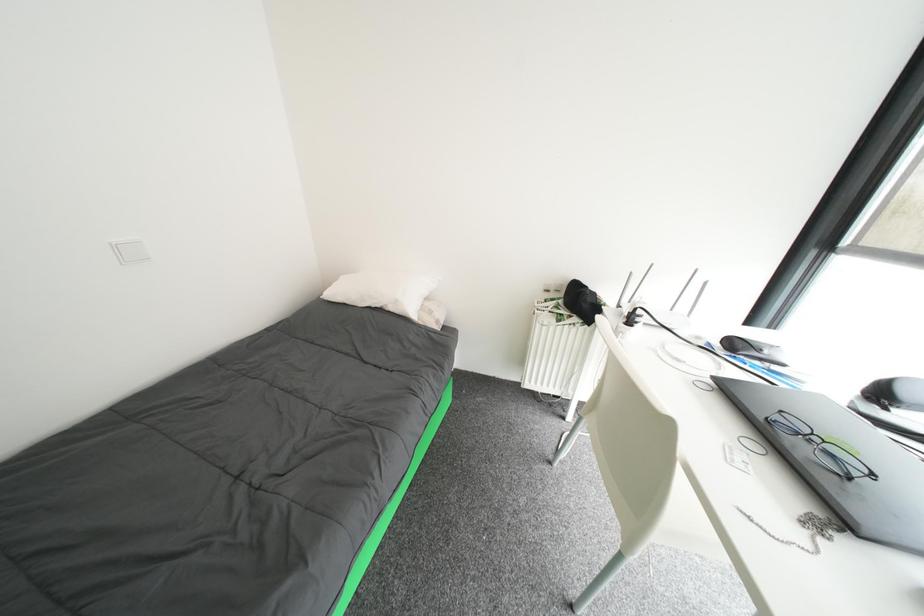
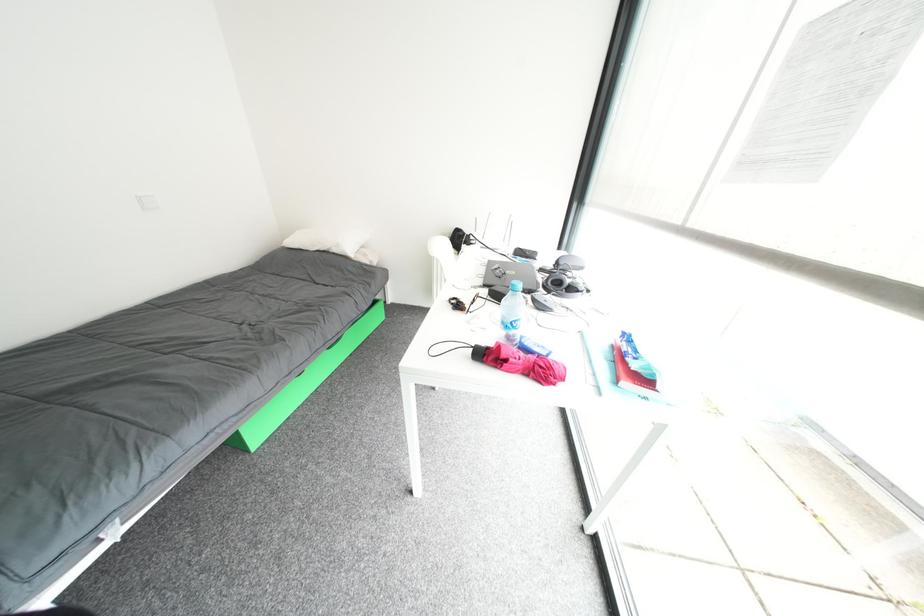
What movement of the cameraman would produce the second image?

The movement direction of the cameraman is right, backward.